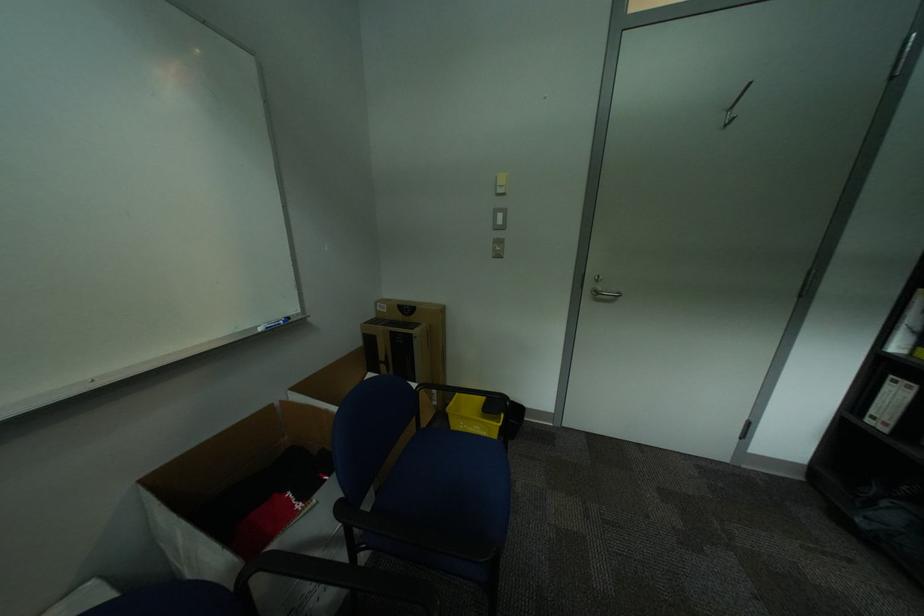
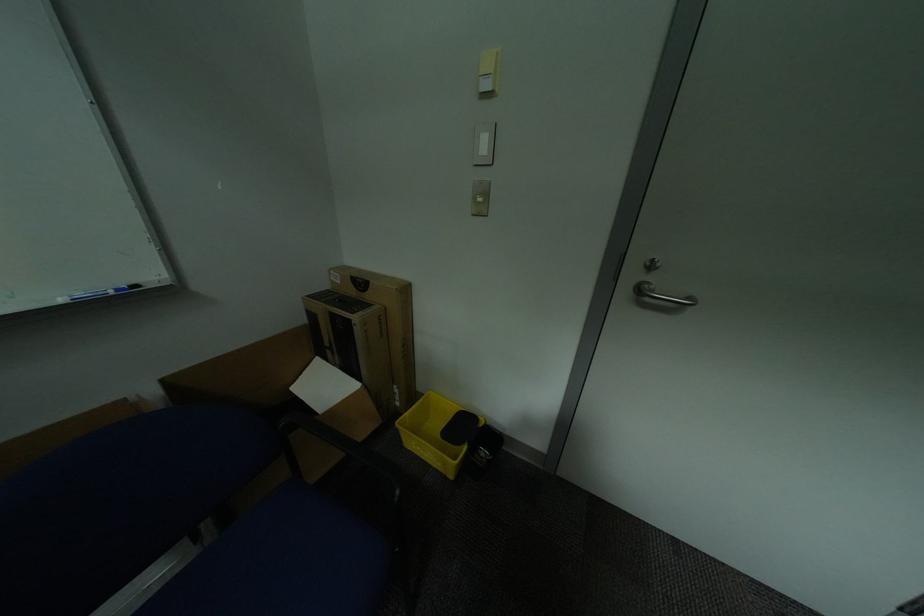
Question: The first image is from the beginning of the video and the second image is from the end. How did the camera likely rotate when shooting the video?

Choices:
 (A) Left
 (B) Right
 (C) Up
 (D) Down

Answer: (A)